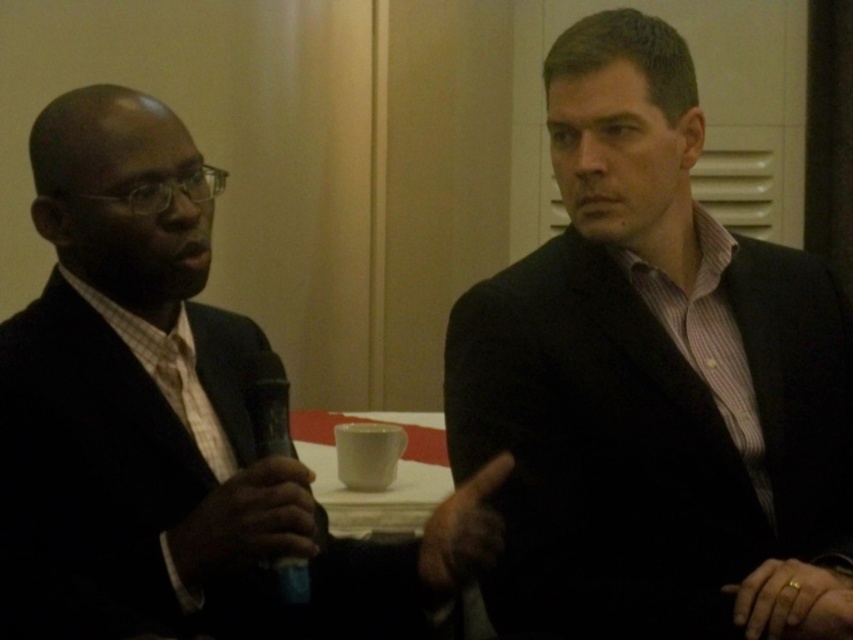
Question: Is matte black suit at left positioned before gold metallic ring at lower right?

Choices:
 (A) no
 (B) yes

Answer: (B)

Question: Which point is closer to the camera?

Choices:
 (A) (175, 358)
 (B) (186, 529)
 (C) (474, 490)
 (D) (735, 612)

Answer: (B)

Question: Estimate the real-world distances between objects in this image. Which object is closer to the matte black suit at center?

Choices:
 (A) black matte microphone at left
 (B) brown leather hand at center
 (C) light brown woven tie at left
 (D) gold metallic ring at lower right

Answer: (B)

Question: From the image, what is the correct spatial relationship of matte black suit at center in relation to light brown woven tie at left?

Choices:
 (A) above
 (B) below

Answer: (A)

Question: Which object is positioned closest to the matte black suit at center?

Choices:
 (A) gold metallic ring at lower right
 (B) matte black suit at left

Answer: (A)

Question: Can you confirm if brown leather hand at center is positioned above light brown woven tie at left?

Choices:
 (A) yes
 (B) no

Answer: (B)